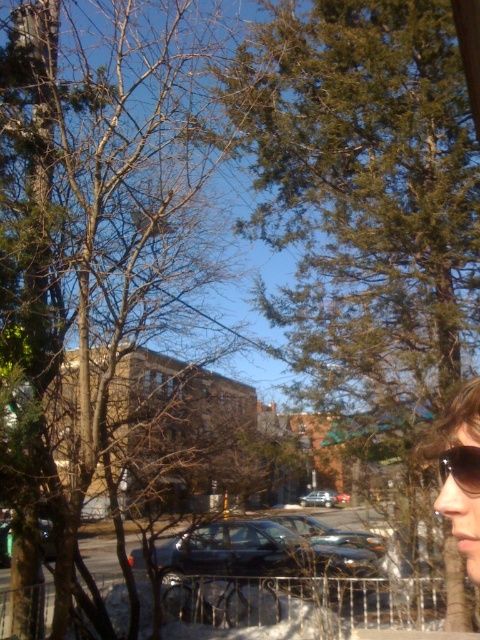
You are standing at the point with coordinates point (2,552) and want to walk towards the point with coordinates point (479,472). Given the street scene described, which direction should you face to move towards your destination?

You should face towards the upper right direction because point (479,472) is closer to the camera than point (2,552), indicating it is located in the upper part of the frame.

You are a drone operator trying to capture a photo of the green leafy tree at upper right. The drone is currently at the center of the image. Which direction should you move the drone to get closer to the tree?

The green leafy tree at upper right is located at point 0.294 on the x axis and 0.760 on the y axis. Since the drone is at the center, you should move it to the left and upwards to reach the tree.

You are a pedestrian standing on the sidewalk and see the green leafy tree at upper right and the bare branches at center. Which one is located more to the right side of the image?

The green leafy tree at upper right is located more to the right side of the image because it is positioned to the right of the bare branches at center.